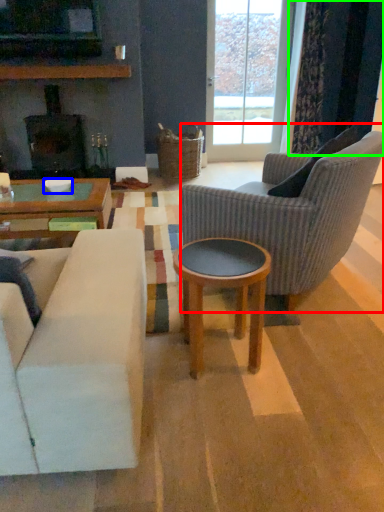
Question: Based on their relative distances, which object is nearer to chair (highlighted by a red box)? Choose from bowl (highlighted by a blue box) and curtain (highlighted by a green box).

Choices:
 (A) bowl
 (B) curtain

Answer: (A)